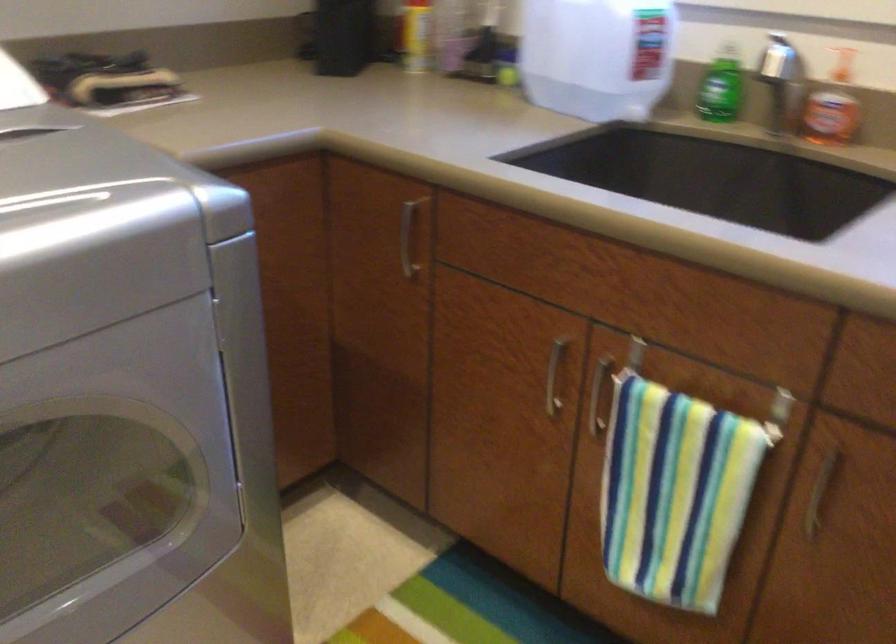
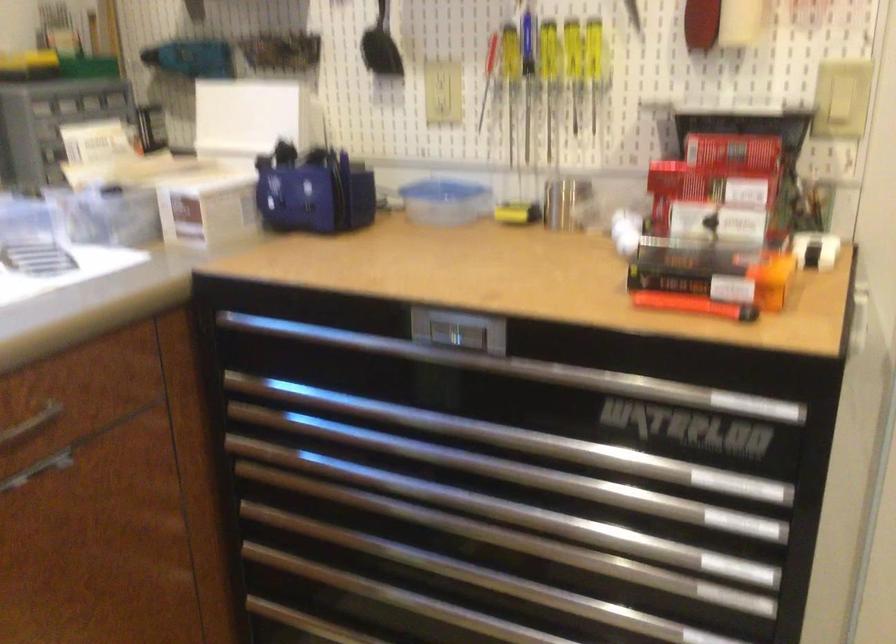
Based on the continuous images, in which direction is the camera rotating?

The camera rotated toward right-down.